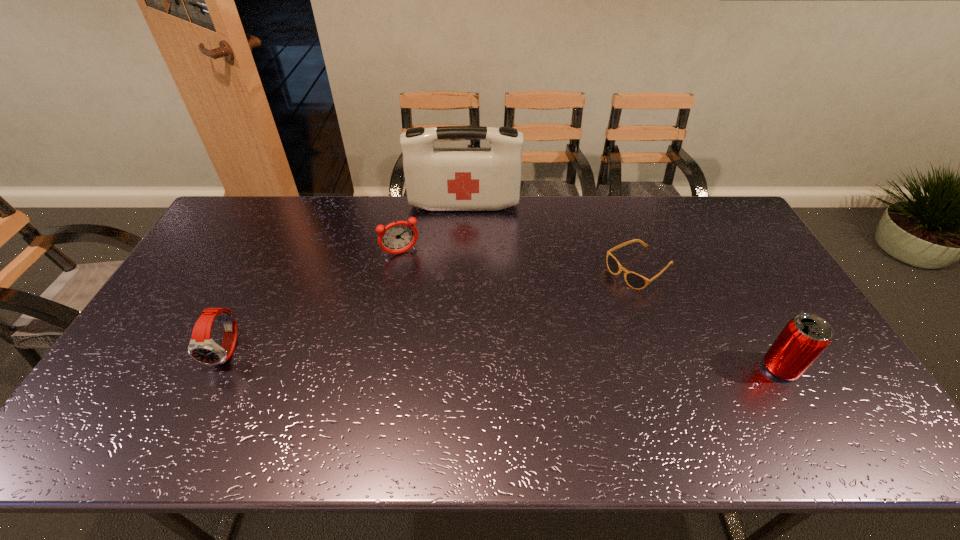
Locate an element on the screen. free point that satisfies the following two spatial constraints: 1. on the front side of the fourth shortest object; 2. on the left side of the fourth object from left to right is located at coordinates (677, 368).

At what (x,y) coordinates should I click in order to perform the action: click on vacant region that satisfies the following two spatial constraints: 1. on the face of the rightmost object; 2. on the right side of the leftmost object. Please return your answer as a coordinate pair (x, y). The width and height of the screenshot is (960, 540). Looking at the image, I should click on (220, 368).

Locate an element on the screen. This screenshot has width=960, height=540. vacant space that satisfies the following two spatial constraints: 1. on the front side of the first-aid kit; 2. on the left side of the second tallest object is located at coordinates (457, 368).